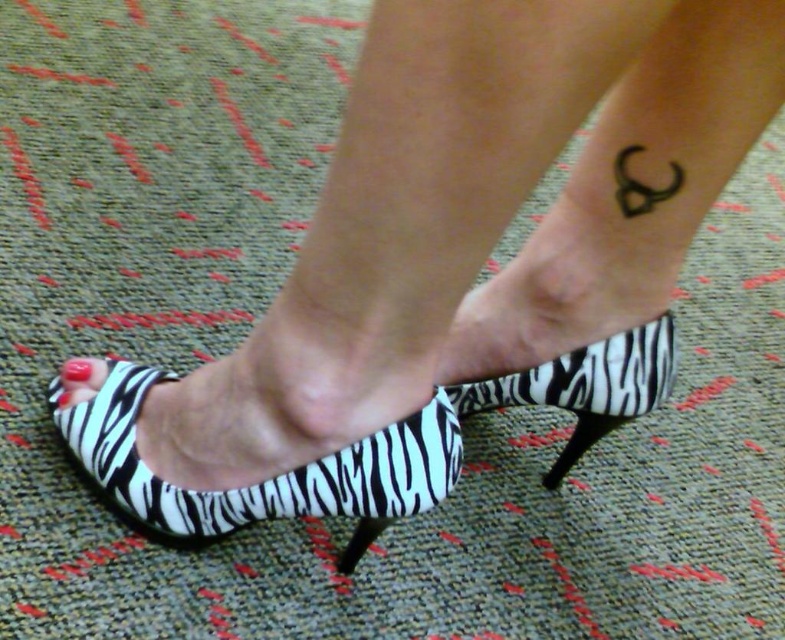
Is glossy red nail at lower left to the left of matte pink nail polish at lower left from the viewer's perspective?

Incorrect, glossy red nail at lower left is not on the left side of matte pink nail polish at lower left.

Is glossy red nail at lower left positioned at the back of matte pink nail polish at lower left?

No.

At what (x,y) coordinates should I click in order to perform the action: click on glossy red nail at lower left. Please return your answer as a coordinate pair (x, y). Image resolution: width=785 pixels, height=640 pixels. Looking at the image, I should click on (82, 372).

Does point (594, 406) come closer to viewer compared to point (616, 177)?

That is False.

Does zebra print sandal at center appear on the left side of black ink tattoo at lower right?

Indeed, zebra print sandal at center is positioned on the left side of black ink tattoo at lower right.

Which is behind, point (575, 355) or point (641, 186)?

Positioned behind is point (575, 355).

Where is `zebra print sandal at center`? Image resolution: width=785 pixels, height=640 pixels. zebra print sandal at center is located at coordinates (585, 387).

Does point (188, 513) come in front of point (345, 572)?

Yes.

Can you confirm if zebra print sandal at lower center is smaller than zebra print heel at lower center?

Incorrect, zebra print sandal at lower center is not smaller in size than zebra print heel at lower center.

Is point (320, 515) closer to camera compared to point (358, 547)?

Yes, it is in front of point (358, 547).

This screenshot has width=785, height=640. I want to click on zebra print sandal at lower center, so click(x=261, y=481).